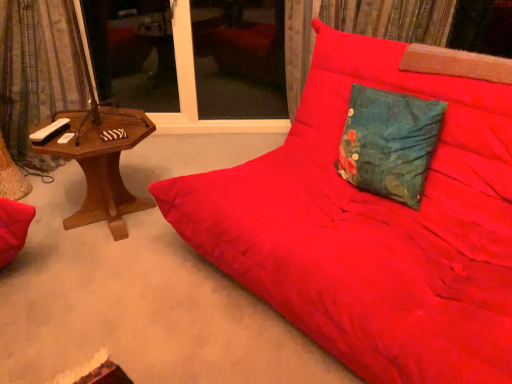
Question: Should I look upward or downward to see velvet-like curtain at left?

Choices:
 (A) up
 (B) down

Answer: (A)

Question: Is teal floral fabric pillow at center at the back of velvet-like curtain at left?

Choices:
 (A) yes
 (B) no

Answer: (B)

Question: Does velvet-like curtain at left have a larger size compared to teal floral fabric pillow at center?

Choices:
 (A) yes
 (B) no

Answer: (A)

Question: Considering the relative sizes of velvet-like curtain at left and teal floral fabric pillow at center in the image provided, is velvet-like curtain at left shorter than teal floral fabric pillow at center?

Choices:
 (A) no
 (B) yes

Answer: (A)

Question: Considering the relative positions of velvet-like curtain at left and teal floral fabric pillow at center in the image provided, is velvet-like curtain at left behind teal floral fabric pillow at center?

Choices:
 (A) no
 (B) yes

Answer: (B)

Question: Would you say velvet-like curtain at left is outside teal floral fabric pillow at center?

Choices:
 (A) no
 (B) yes

Answer: (B)

Question: Can you confirm if velvet-like curtain at left is smaller than teal floral fabric pillow at center?

Choices:
 (A) no
 (B) yes

Answer: (A)

Question: Does velvet-like curtain at left appear on the left side of transparent glass window at center, which is counted as the 2th window screen, starting from the left?

Choices:
 (A) yes
 (B) no

Answer: (A)

Question: From the image's perspective, is velvet-like curtain at left above transparent glass window at center, which is the 1th window screen in right-to-left order?

Choices:
 (A) no
 (B) yes

Answer: (A)

Question: From a real-world perspective, is velvet-like curtain at left on top of transparent glass window at center, which is the 1th window screen in right-to-left order?

Choices:
 (A) yes
 (B) no

Answer: (A)

Question: Is velvet-like curtain at left next to transparent glass window at center, which is the 1th window screen in right-to-left order, and touching it?

Choices:
 (A) yes
 (B) no

Answer: (B)

Question: Considering the relative sizes of velvet-like curtain at left and transparent glass window at center, which is the 1th window screen in right-to-left order, in the image provided, is velvet-like curtain at left wider than transparent glass window at center, which is the 1th window screen in right-to-left order,?

Choices:
 (A) no
 (B) yes

Answer: (B)

Question: Is velvet-like curtain at left located outside transparent glass window at center, which is counted as the 2th window screen, starting from the left?

Choices:
 (A) no
 (B) yes

Answer: (B)

Question: Is velvet-like curtain at left shorter than woodenmaterial/texturetable at left?

Choices:
 (A) yes
 (B) no

Answer: (B)